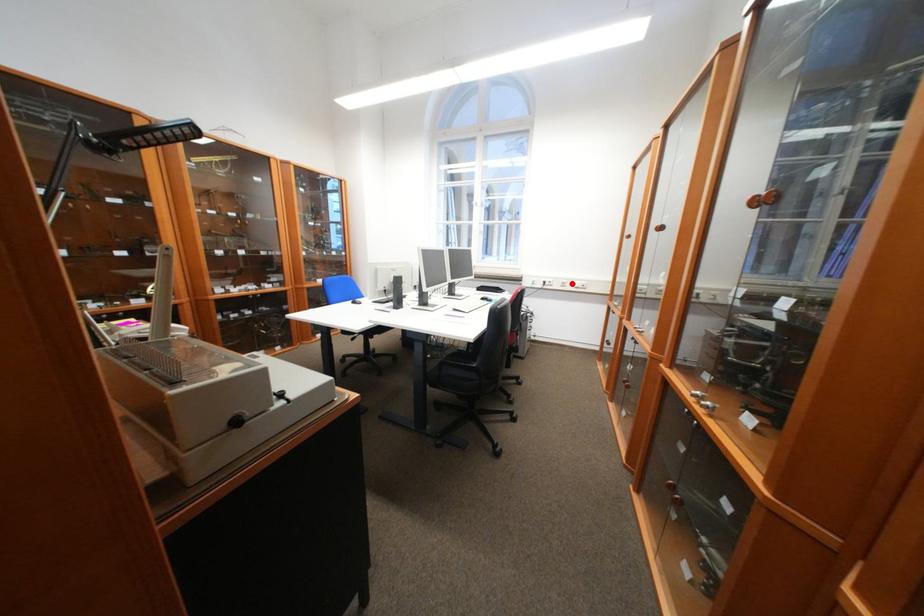
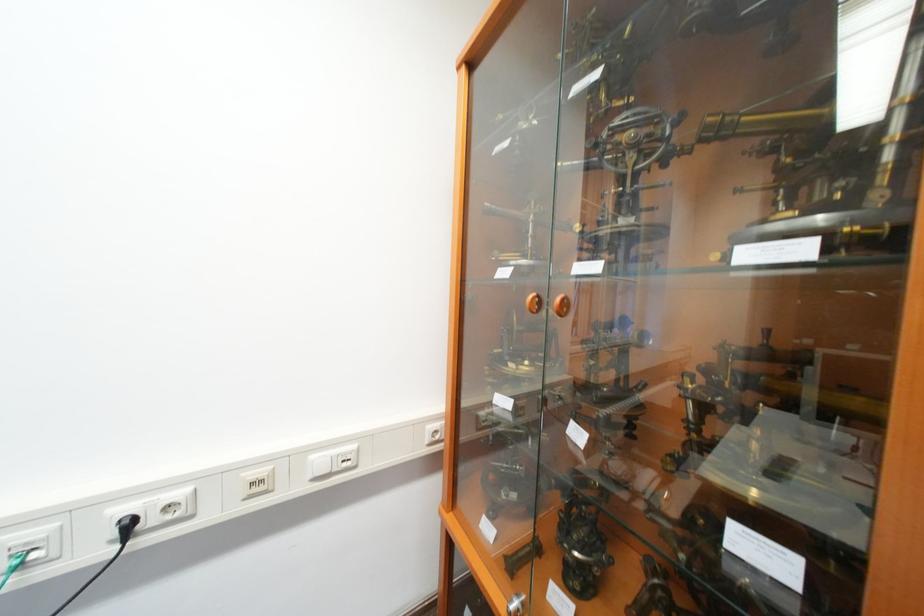
Question: I am providing you with two images of the same scene from different viewpoints. In image1, a red point is highlighted. Considering the same 3D point in image2, which of the following is correct?

Choices:
 (A) It is closer
 (B) It is farther

Answer: (B)